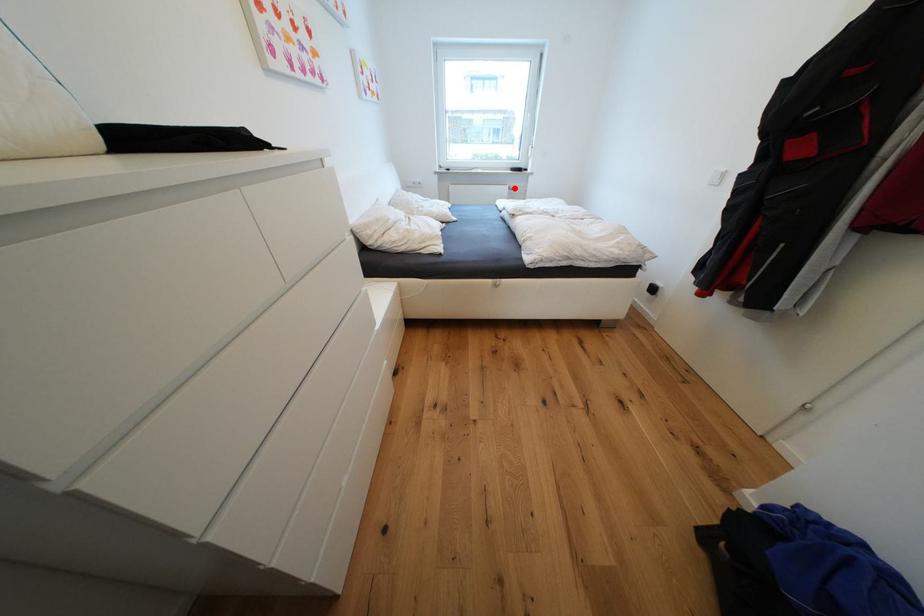
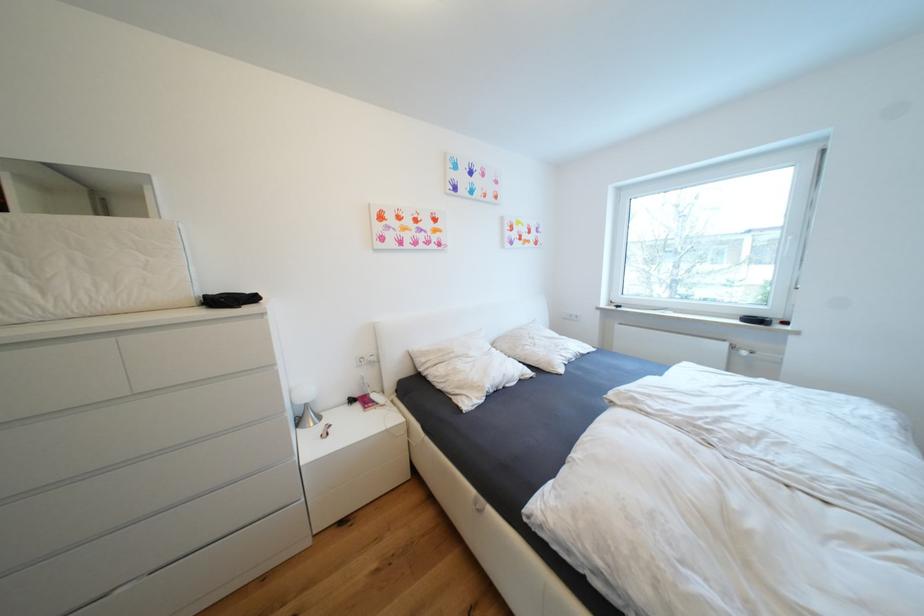
Question: I am providing you with two images of the same scene from different viewpoints. A red point is shown in image1. For the corresponding object point in image2, is it positioned nearer or farther from the camera?

Choices:
 (A) Nearer
 (B) Farther

Answer: (B)